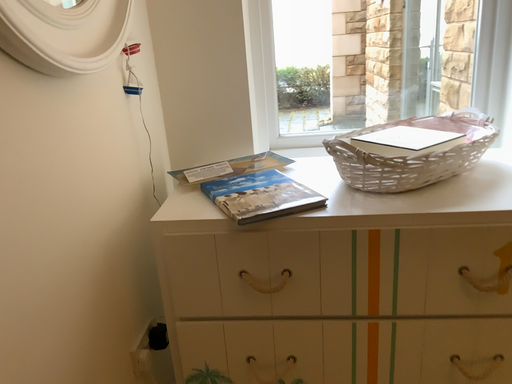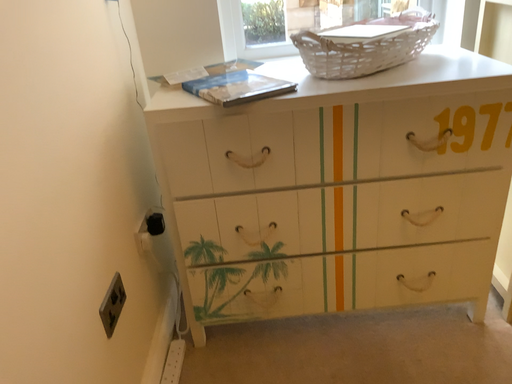
Question: Which way did the camera rotate in the video?

Choices:
 (A) rotated downward
 (B) rotated upward

Answer: (A)